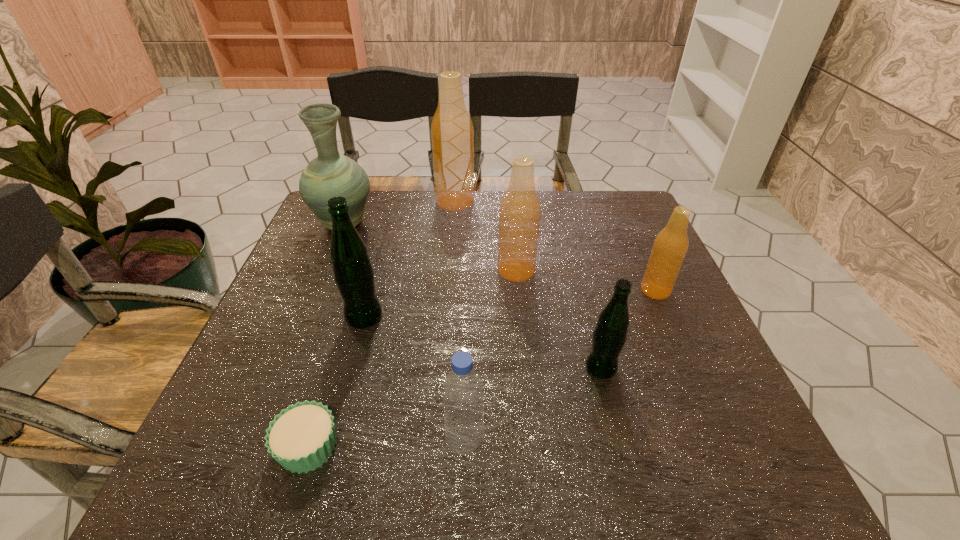
Where is `free spot located 0.190m on the left of the bottle`? This screenshot has width=960, height=540. free spot located 0.190m on the left of the bottle is located at coordinates (337, 441).

This screenshot has height=540, width=960. I want to click on free space located 0.380m on the right of the shortest object, so click(561, 447).

Locate an element on the screen. This screenshot has height=540, width=960. beer bottle that is at the far edge is located at coordinates (452, 134).

The height and width of the screenshot is (540, 960). I want to click on pitcher at the far edge, so click(331, 174).

At what (x,y) coordinates should I click in order to perform the action: click on bottle that is at the near edge. Please return your answer as a coordinate pair (x, y). This screenshot has height=540, width=960. Looking at the image, I should click on (463, 398).

What are the coordinates of `cupcake that is at the near edge` in the screenshot? It's located at tap(301, 438).

You are a GUI agent. You are given a task and a screenshot of the screen. Output one action in this format:
    pyautogui.click(x=<x>, y=<y>)
    Task: Click on the pitcher positioned at the left edge
    
    Given the screenshot: What is the action you would take?
    pyautogui.click(x=331, y=174)

Identify the location of cupcake that is at the left edge. (301, 438).

This screenshot has height=540, width=960. I want to click on object present at the right edge, so click(x=670, y=246).

The image size is (960, 540). Identify the location of object located at the far left corner. (331, 174).